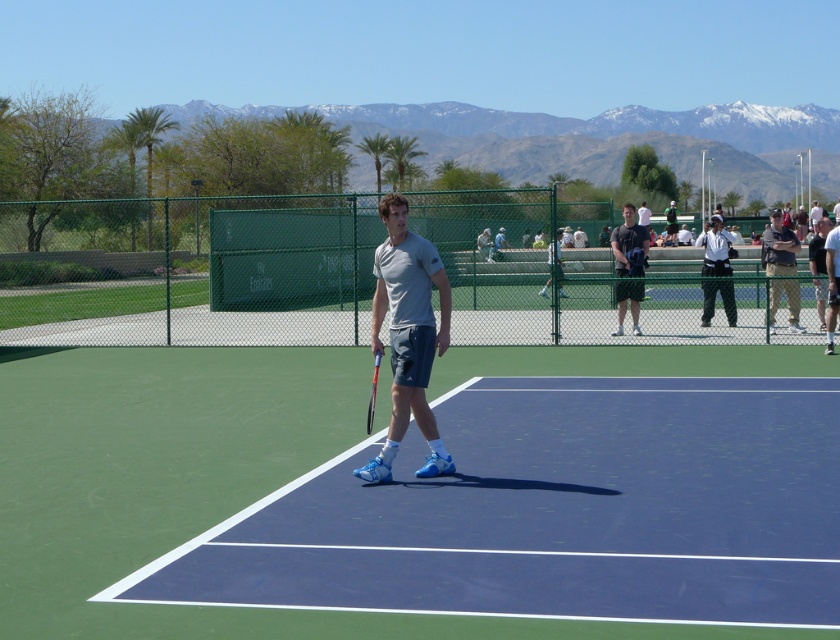
Is matte black shirt at center wider than black matte tennis racket at center?

Indeed, matte black shirt at center has a greater width compared to black matte tennis racket at center.

Does point (617, 260) come closer to viewer compared to point (369, 422)?

No, (617, 260) is behind (369, 422).

Find the location of `matte black shirt at center`. matte black shirt at center is located at coordinates (630, 244).

Can you confirm if dark green pants at right is positioned below matte gray shirt at center?

Correct, dark green pants at right is located below matte gray shirt at center.

Is dark green pants at right further to the viewer compared to matte gray shirt at center?

No, it is not.

What do you see at coordinates (714, 250) in the screenshot?
I see `dark green pants at right` at bounding box center [714, 250].

In order to click on dark green pants at right in this screenshot , I will do `click(714, 250)`.

Measure the distance between matte black shirt at center and camera.

matte black shirt at center and camera are 18.11 meters apart from each other.

Is matte black shirt at center smaller than matte gray shirt at center?

Correct, matte black shirt at center occupies less space than matte gray shirt at center.

Measure the distance between point (626, 262) and camera.

The distance of point (626, 262) from camera is 60.40 feet.

Locate an element on the screen. The image size is (840, 640). matte black shirt at center is located at coordinates (630, 244).